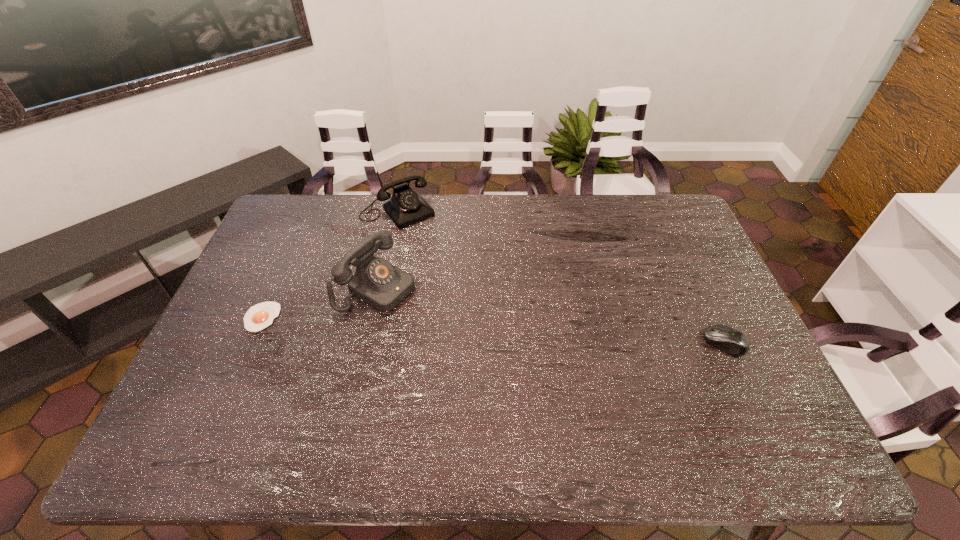
This screenshot has width=960, height=540. In order to click on free space on the desktop that is between the shortest object and the rightmost object and is positioned on the dial of the taller telephone in this screenshot , I will do `click(452, 328)`.

The height and width of the screenshot is (540, 960). Find the location of `vacant space on the desktop that is between the egg yolk and the rightmost object and is positioned on the front face of the farthest object`. vacant space on the desktop that is between the egg yolk and the rightmost object and is positioned on the front face of the farthest object is located at coordinates pos(494,330).